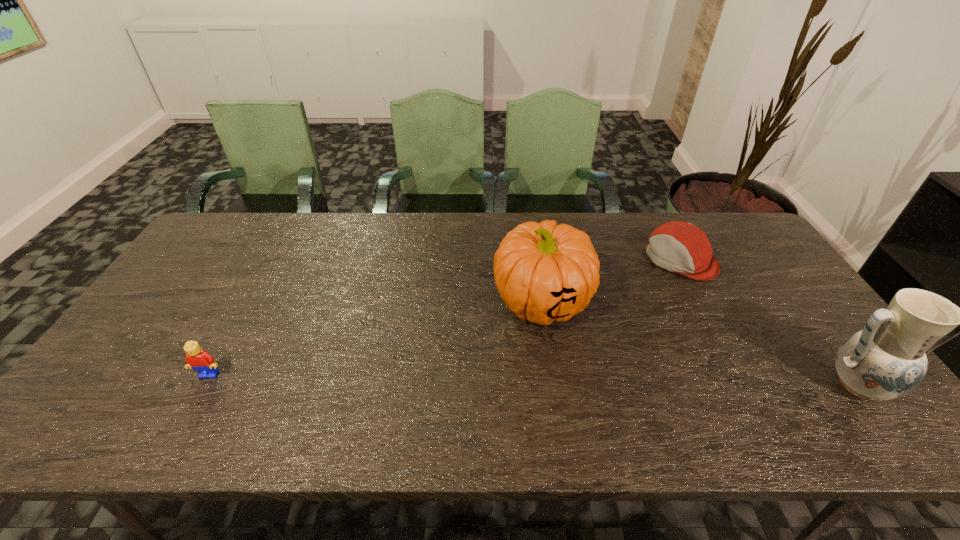
Where is `the leftmost object`? This screenshot has height=540, width=960. the leftmost object is located at coordinates (198, 359).

Where is `pottery`? This screenshot has width=960, height=540. pottery is located at coordinates (887, 359).

At what (x,y) coordinates should I click in order to perform the action: click on pumpkin. Please return your answer as a coordinate pair (x, y). This screenshot has width=960, height=540. Looking at the image, I should click on (544, 272).

Locate an element on the screen. the second object from right to left is located at coordinates (680, 247).

This screenshot has width=960, height=540. In order to click on vacant space located on the front-facing side of the leftmost object in this screenshot , I will do `click(195, 402)`.

Locate an element on the screen. free space located 0.230m on the surface of the pumpkin is located at coordinates (468, 396).

You are a GUI agent. You are given a task and a screenshot of the screen. Output one action in this format:
    pyautogui.click(x=<x>, y=<y>)
    Task: Click on the free space located 0.060m on the surface of the pumpkin
    This screenshot has width=960, height=540.
    Given the screenshot: What is the action you would take?
    pyautogui.click(x=506, y=348)

Image resolution: width=960 pixels, height=540 pixels. What are the coordinates of `vacant space positioned on the surface of the pumpkin` in the screenshot? It's located at (497, 359).

The image size is (960, 540). In order to click on free space located 0.110m on the front-facing side of the cap in this screenshot , I will do `click(641, 292)`.

At what (x,y) coordinates should I click in order to perform the action: click on vacant region located 0.220m on the front-facing side of the cap. Please return your answer as a coordinate pair (x, y). Looking at the image, I should click on (618, 309).